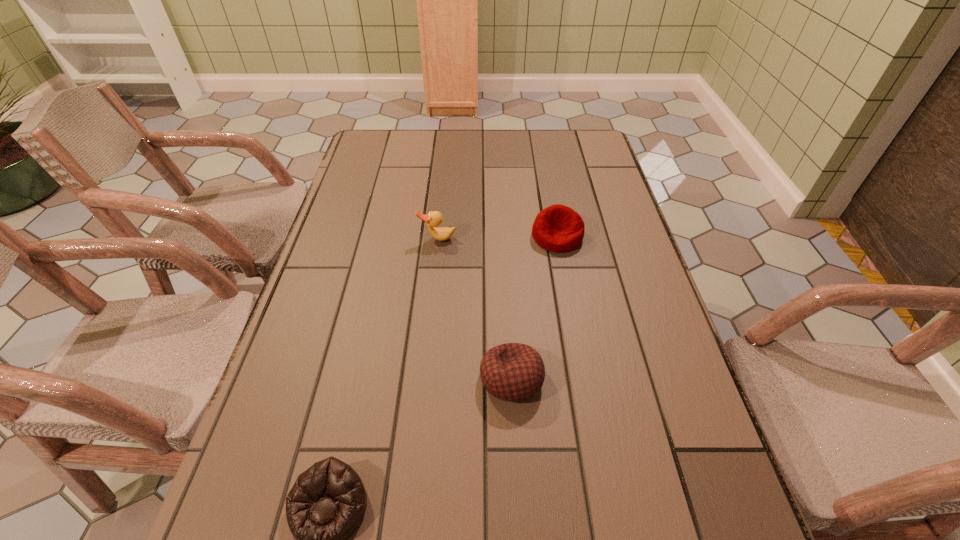
Where is `free spot at the left edge of the desktop`? Image resolution: width=960 pixels, height=540 pixels. free spot at the left edge of the desktop is located at coordinates (254, 436).

In the image, there is a desktop. What are the coordinates of `vacant space at the right edge` in the screenshot? It's located at (644, 526).

This screenshot has width=960, height=540. Find the location of `blank space at the far left corner of the desktop`. blank space at the far left corner of the desktop is located at coordinates (407, 152).

The height and width of the screenshot is (540, 960). I want to click on vacant position at the far right corner of the desktop, so click(x=569, y=130).

Where is `vacant space that's between the second beanbag from right to left and the rightmost beanbag`? vacant space that's between the second beanbag from right to left and the rightmost beanbag is located at coordinates (534, 307).

Identify the location of empty location between the third object from left to right and the duck. The image size is (960, 540). (474, 308).

This screenshot has height=540, width=960. Identify the location of empty location between the third object from right to left and the rightmost object. point(497,237).

Image resolution: width=960 pixels, height=540 pixels. In order to click on the third closest object to the second beanbag from right to left in this screenshot , I will do `click(435, 218)`.

Choose which object is the nearest neighbor to the second object from left to right. Please provide its 2D coordinates. Your answer should be formatted as a tuple, i.e. [(x, y)], where the tuple contains the x and y coordinates of a point satisfying the conditions above.

[(558, 228)]

Identify which beanbag is the closest to the second nearest beanbag. Please provide its 2D coordinates. Your answer should be formatted as a tuple, i.e. [(x, y)], where the tuple contains the x and y coordinates of a point satisfying the conditions above.

[(328, 501)]